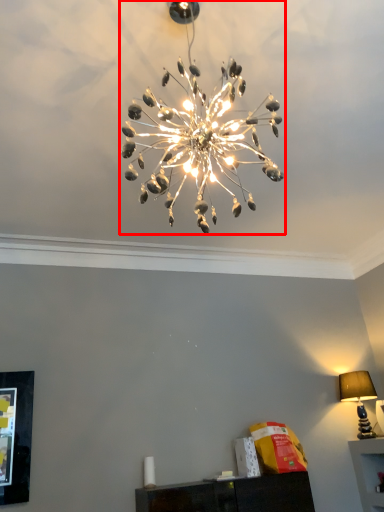
Question: Considering the relative positions of lamp (annotated by the red box) and lamp in the image provided, where is lamp (annotated by the red box) located with respect to the staircase?

Choices:
 (A) left
 (B) right

Answer: (A)